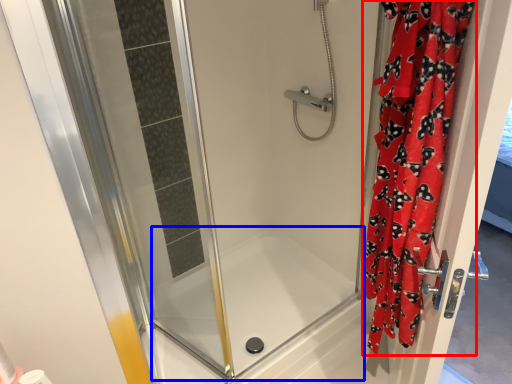
Question: Which object appears closest to the camera in this image, curtain (highlighted by a red box) or bath (highlighted by a blue box)?

Choices:
 (A) curtain
 (B) bath

Answer: (A)